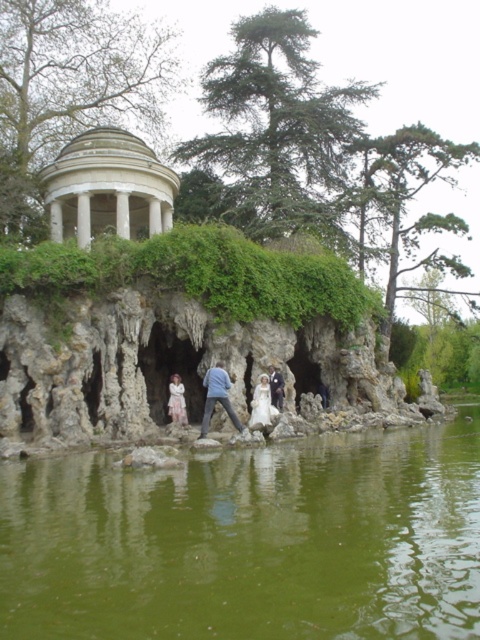
You are standing at the edge of the park and see the green liquid water at center. If you want to throw a small pebble into the water, will you be able to reach it from your current position? Please explain your reasoning.

The green liquid water at center is 8.45 meters away from the viewer. Since the average throwing distance for a small pebble is around 10 meters, you might be able to reach it but it would require a strong throw. However, there might be obstacles like the chain barrier mentioned in the scene description that could interfere.

You are standing in the park and want to take a photo of the white cotton dress at center without the white marble gazebo at upper center blocking the view. Is this possible?

The white cotton dress at center is behind the white marble gazebo at upper center, so it is already blocked by the gazebo. Therefore, you cannot take a photo of the white cotton dress at center without the gazebo obstructing the view.

You are standing in the park and want to take a photo of both point (136, 196) and point (273, 371). Which point should you focus on first to ensure both are in clear view?

You should focus on point (136, 196) first because it is closer to you than point (273, 371), ensuring both points are in clear view.